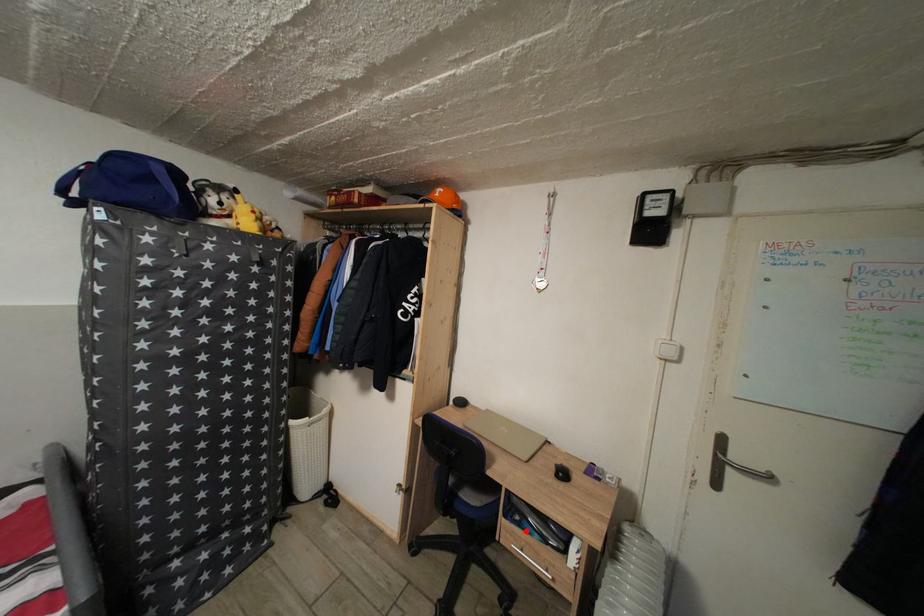
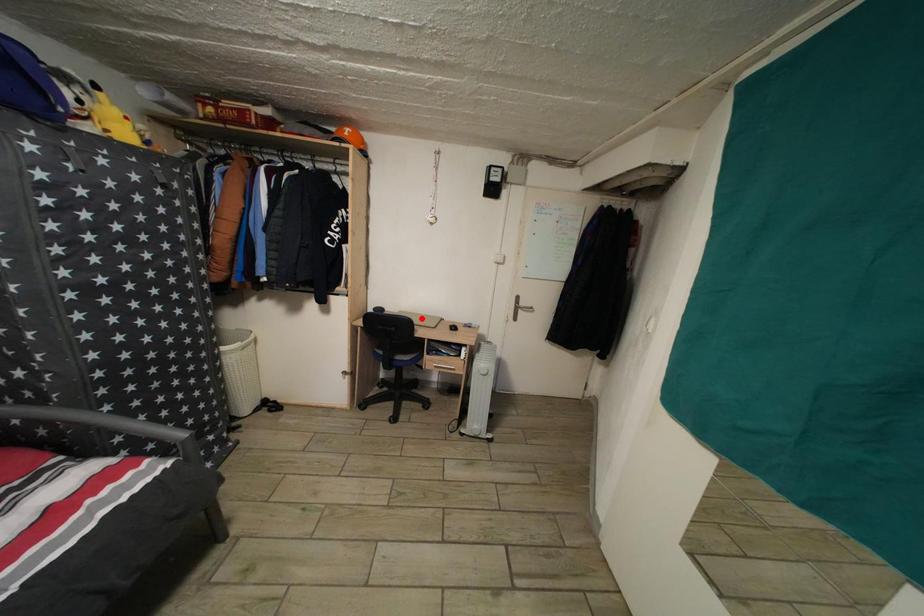
I am providing you with two images of the same scene from different viewpoints. A red point is marked on the first image and another point is marked on the second image. Are the points marked in image1 and image2 representing the same 3D position?

No